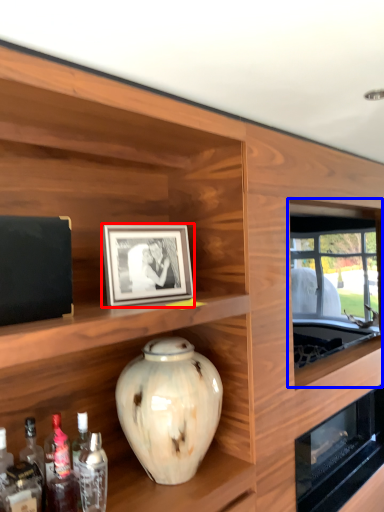
Question: Among these objects, which one is nearest to the camera, picture frame (highlighted by a red box) or window (highlighted by a blue box)?

Choices:
 (A) picture frame
 (B) window

Answer: (A)